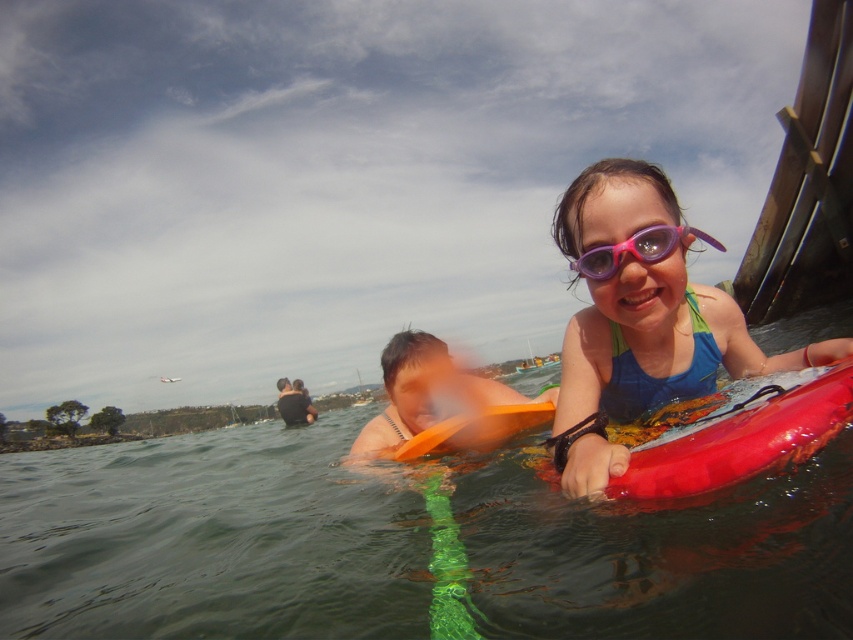
Question: Can you confirm if blue fabric swimsuit at upper right is positioned to the left of purple matte goggles at upper center?

Choices:
 (A) yes
 (B) no

Answer: (B)

Question: Can you confirm if blue fabric swimsuit at upper right is wider than rubberized red canoe at right?

Choices:
 (A) no
 (B) yes

Answer: (B)

Question: Which of the following is the farthest from the observer?

Choices:
 (A) (635, 208)
 (B) (666, 240)

Answer: (A)

Question: Which point is farther to the camera?

Choices:
 (A) (x=751, y=412)
 (B) (x=605, y=160)
 (C) (x=671, y=244)

Answer: (B)

Question: Is rubberized red canoe at right thinner than orange foam paddle at center?

Choices:
 (A) no
 (B) yes

Answer: (B)

Question: Among these objects, which one is nearest to the camera?

Choices:
 (A) purple matte goggles at upper center
 (B) rubberized red canoe at right
 (C) blue fabric swimsuit at upper right
 (D) orange foam paddle at center

Answer: (B)